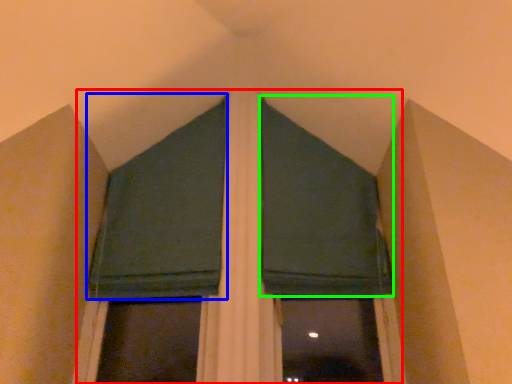
Question: Which is farther away from bay window (highlighted by a red box)? curtain (highlighted by a blue box) or curtain (highlighted by a green box)?

Choices:
 (A) curtain
 (B) curtain

Answer: (A)